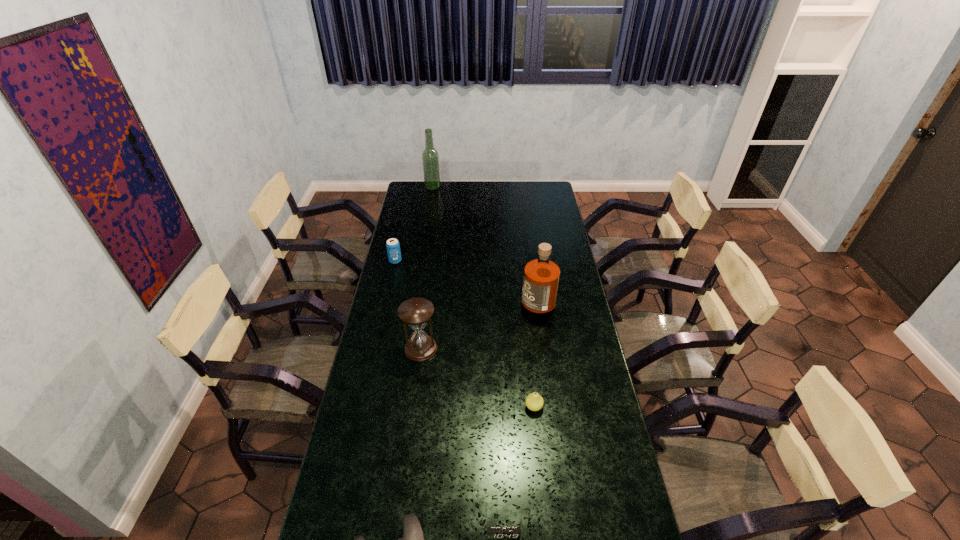
Locate an element on the screen. Image resolution: width=960 pixels, height=540 pixels. the farthest object is located at coordinates (430, 158).

The image size is (960, 540). Identify the location of the farther liquor. (430, 158).

Locate an element on the screen. The image size is (960, 540). the right liquor is located at coordinates (541, 277).

The height and width of the screenshot is (540, 960). In order to click on the nearer liquor in this screenshot , I will do `click(541, 277)`.

Identify the location of hourglass. This screenshot has height=540, width=960. tap(415, 312).

Identify the location of the fourth farthest object. The width and height of the screenshot is (960, 540). (415, 312).

Identify the location of the fourth shortest object. click(393, 247).

Identify the location of the leftmost object. This screenshot has width=960, height=540. (393, 247).

This screenshot has width=960, height=540. I want to click on the fifth tallest object, so click(534, 402).

This screenshot has width=960, height=540. Find the location of `the third nearest object`. the third nearest object is located at coordinates (534, 402).